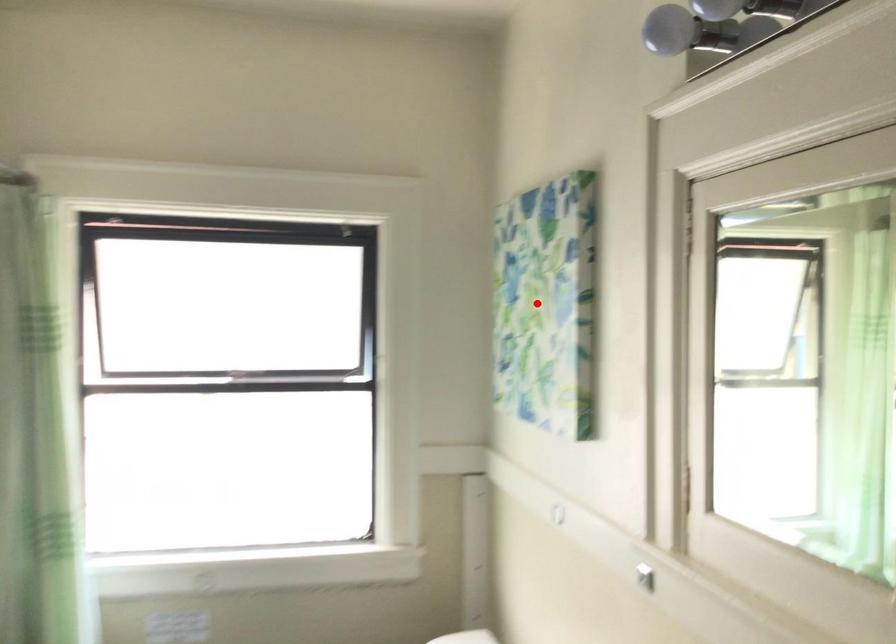
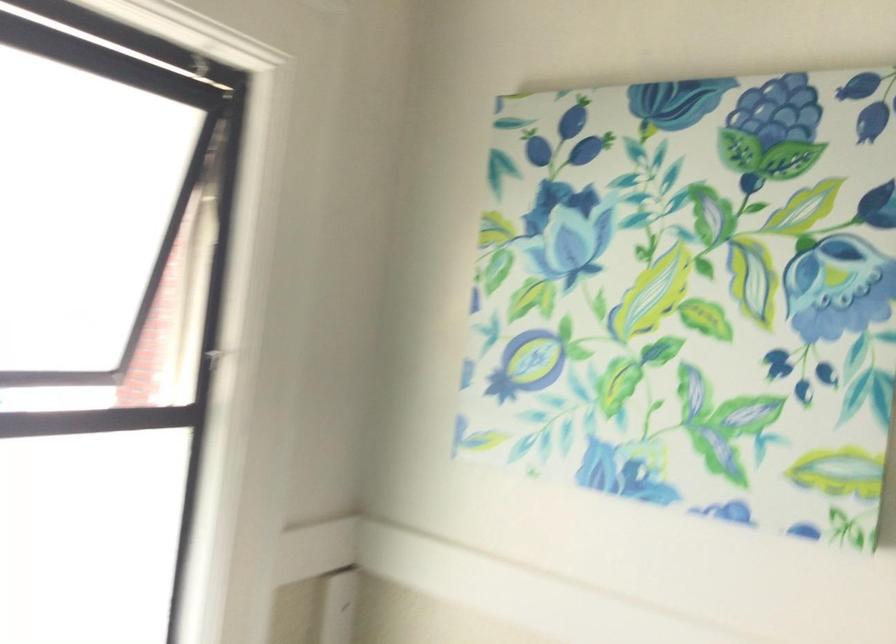
Locate, in the second image, the point that corresponds to the highlighted location in the first image.

(693, 292)